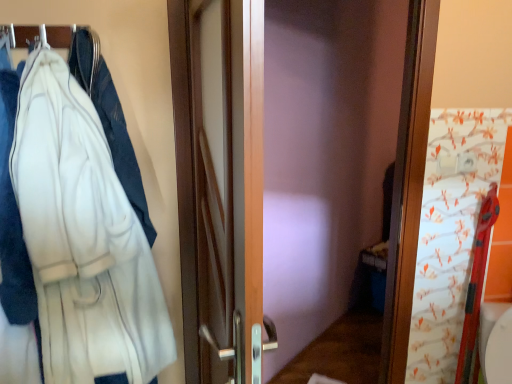
Question: Does metallic silver hanger at upper left appear on the right side of white fleece bathrobe at left?

Choices:
 (A) yes
 (B) no

Answer: (B)

Question: Considering the relative sizes of metallic silver hanger at upper left and white fleece bathrobe at left in the image provided, is metallic silver hanger at upper left bigger than white fleece bathrobe at left?

Choices:
 (A) yes
 (B) no

Answer: (B)

Question: Would you say white fleece bathrobe at left is part of metallic silver hanger at upper left's contents?

Choices:
 (A) no
 (B) yes

Answer: (A)

Question: From the image's perspective, is metallic silver hanger at upper left under white fleece bathrobe at left?

Choices:
 (A) yes
 (B) no

Answer: (B)

Question: Does metallic silver hanger at upper left have a greater height compared to white fleece bathrobe at left?

Choices:
 (A) no
 (B) yes

Answer: (A)

Question: Considering their positions, is white fleece jacket at left located in front of or behind white fleece bathrobe at left?

Choices:
 (A) behind
 (B) front

Answer: (A)

Question: Would you say white fleece jacket at left is inside or outside white fleece bathrobe at left?

Choices:
 (A) inside
 (B) outside

Answer: (A)

Question: Is white fleece jacket at left taller or shorter than white fleece bathrobe at left?

Choices:
 (A) tall
 (B) short

Answer: (B)

Question: From the image's perspective, is white fleece jacket at left above or below white fleece bathrobe at left?

Choices:
 (A) above
 (B) below

Answer: (A)

Question: Is metallic silver hanger at upper left inside the boundaries of white fleece jacket at left, or outside?

Choices:
 (A) outside
 (B) inside

Answer: (A)

Question: In terms of height, does metallic silver hanger at upper left look taller or shorter compared to white fleece jacket at left?

Choices:
 (A) tall
 (B) short

Answer: (B)

Question: Relative to white fleece jacket at left, is metallic silver hanger at upper left in front or behind?

Choices:
 (A) front
 (B) behind

Answer: (B)

Question: From a real-world perspective, is metallic silver hanger at upper left above or below white fleece jacket at left?

Choices:
 (A) below
 (B) above

Answer: (B)

Question: From a real-world perspective, is metallic silver hanger at upper left physically located above or below white fleece bathrobe at left?

Choices:
 (A) above
 (B) below

Answer: (A)

Question: Is point (11, 36) closer or farther from the camera than point (27, 188)?

Choices:
 (A) farther
 (B) closer

Answer: (A)